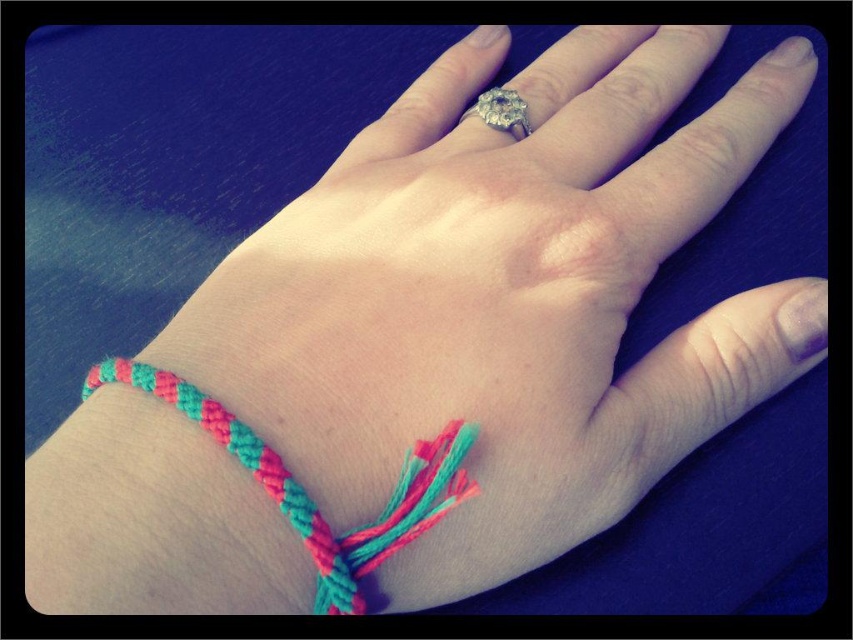
You are a jeweler examining the hand in the image. You need to remove the diamond ring at center without disturbing the braided fabric bracelet at lower left. Is this possible given their positions?

The braided fabric bracelet at lower left is positioned under the diamond ring at center, so removing the ring should be possible without disturbing the bracelet since it is underneath.

You are a photographer adjusting the focus on your camera. You have two points in the image to focus on, point (173, 392) and point (486, 104). Which point should you focus on to ensure it appears sharp in the foreground?

Point (173, 392) is closer to the camera than point (486, 104), so you should focus on point (173, 392) to ensure it appears sharp in the foreground.